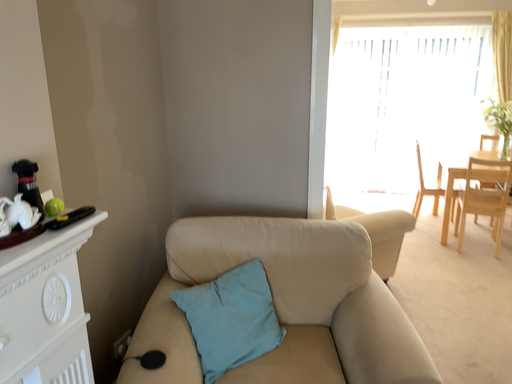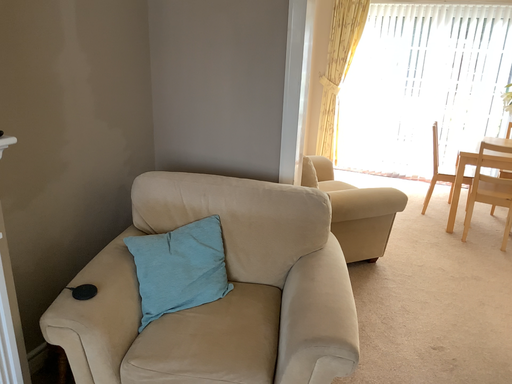
Question: Which way did the camera rotate in the video?

Choices:
 (A) rotated right
 (B) rotated left

Answer: (B)